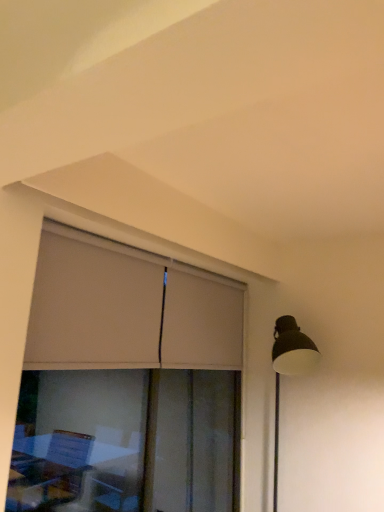
Question: Is beige fabric curtain at upper left to the left or to the right of matte beige window at center in the image?

Choices:
 (A) left
 (B) right

Answer: (B)

Question: Relative to matte beige window at center, is beige fabric curtain at upper left in front or behind?

Choices:
 (A) front
 (B) behind

Answer: (B)

Question: Is point (135, 266) positioned closer to the camera than point (44, 258)?

Choices:
 (A) farther
 (B) closer

Answer: (A)

Question: Is matte beige window at center spatially inside beige fabric curtain at upper left, or outside of it?

Choices:
 (A) outside
 (B) inside

Answer: (B)

Question: Is point (72, 306) closer or farther from the camera than point (180, 271)?

Choices:
 (A) closer
 (B) farther

Answer: (A)

Question: In the image, is matte beige window at center positioned in front of or behind beige fabric curtain at upper left?

Choices:
 (A) front
 (B) behind

Answer: (A)

Question: From a real-world perspective, is matte beige window at center physically located above or below beige fabric curtain at upper left?

Choices:
 (A) above
 (B) below

Answer: (B)